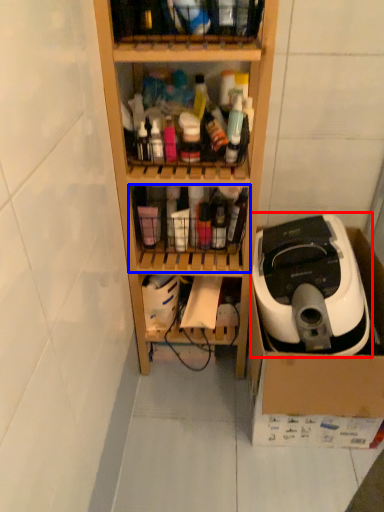
Question: Which object is further to the camera taking this photo, home appliance (highlighted by a red box) or shelf (highlighted by a blue box)?

Choices:
 (A) home appliance
 (B) shelf

Answer: (B)